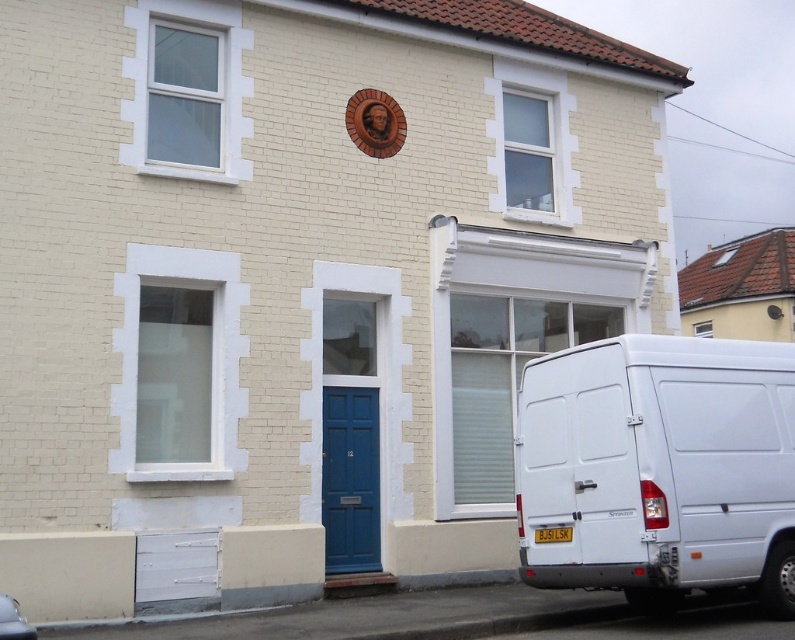
You are a delivery driver who needs to park your white matte van at lower right in front of the blue painted wood door at center. The parking space is exactly the same width as the door. Will your van fit in the space?

The white matte van at lower right is wider than the blue painted wood door at center, so it will not fit in the parking space that matches the door width.

You are standing on the sidewalk in front of the house and want to take a photo of the blue painted wood door at center and the white matte van at lower right. Which object should you focus on first to ensure both are in the frame?

You should focus on the blue painted wood door at center first because the white matte van at lower right is closer to the viewer, so adjusting the camera to include the farther door ensures both are in the frame.

You are a delivery person standing next to the white matte van at lower right and need to deliver a package to the blue painted wood door at center. The delivery robot you use has a maximum operating range of 3 meters. Can the robot reach the door from the van?

The distance between the white matte van at lower right and the blue painted wood door at center is 3.47 meters, which exceeds the robot s 3 meter range. The robot cannot reach the door from the van.